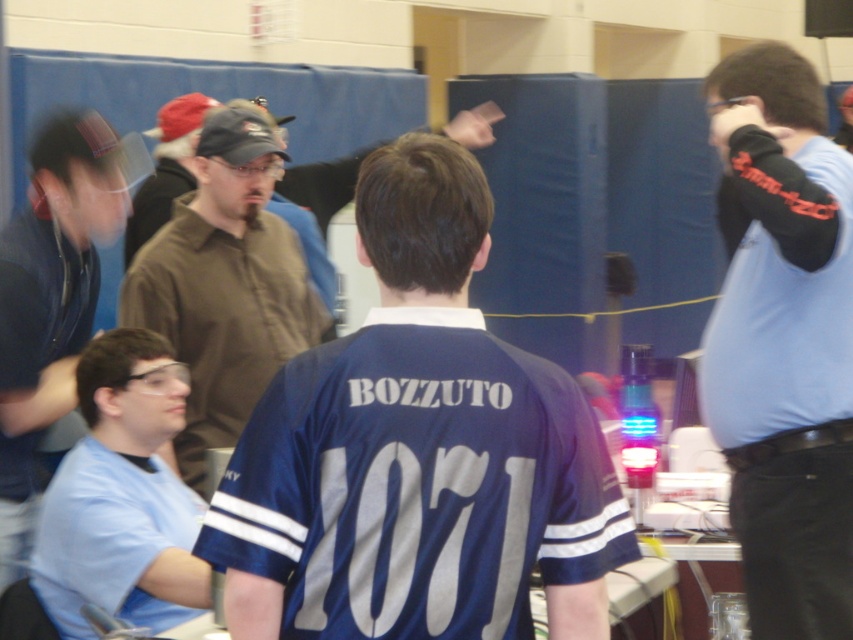
Which is more to the left, brown matte shirt at upper center or light blue shirt at lower left?

Positioned to the left is light blue shirt at lower left.

Is brown matte shirt at upper center to the right of light blue shirt at lower left from the viewer's perspective?

Yes, brown matte shirt at upper center is to the right of light blue shirt at lower left.

Who is more forward, (215,364) or (112,577)?

Point (112,577) is in front.

I want to click on brown matte shirt at upper center, so click(x=225, y=285).

Is light blue shirt at right below light blue shirt at lower left?

Actually, light blue shirt at right is above light blue shirt at lower left.

This screenshot has width=853, height=640. I want to click on light blue shirt at right, so click(x=782, y=340).

Identify the location of light blue shirt at right. The width and height of the screenshot is (853, 640). (782, 340).

Is light blue shirt at lower left smaller than matte black shirt at left?

Incorrect, light blue shirt at lower left is not smaller in size than matte black shirt at left.

The image size is (853, 640). Identify the location of light blue shirt at lower left. (122, 497).

The image size is (853, 640). What are the coordinates of `light blue shirt at lower left` in the screenshot? It's located at (122, 497).